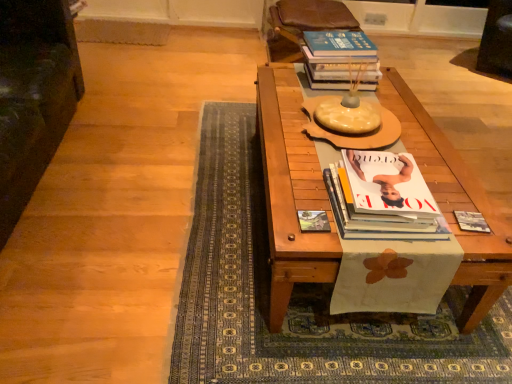
Identify the location of free spot in front of matte paper book cover at center. (315, 246).